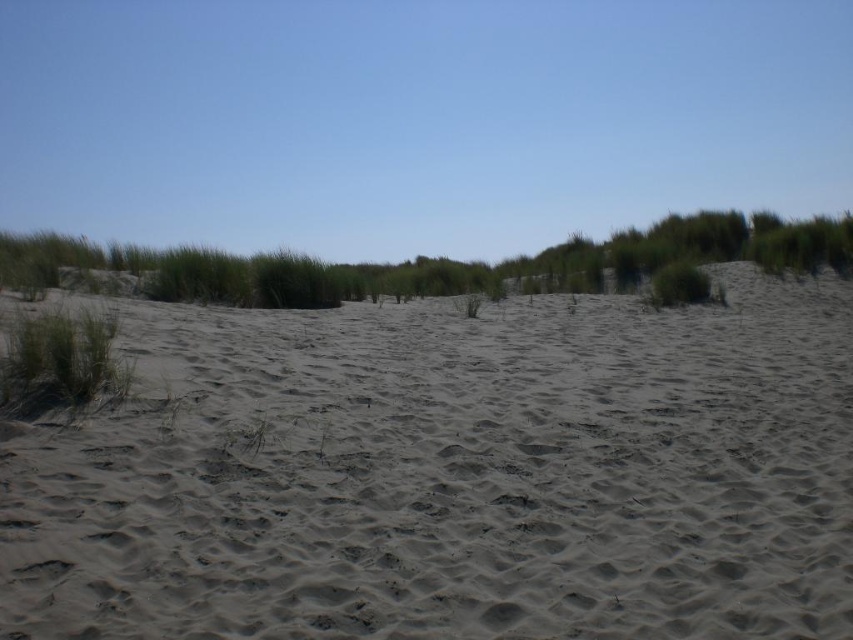
You are a hiker trying to cross the sandy terrain. You notice the smooth sand at center and the green grass at left. Which surface would you choose to walk on if you want to avoid sinking deeper into the ground?

The smooth sand at center has a greater height compared to the green grass at left, so walking on the green grass at left would result in less sinking since it is lower and firmer.

You are standing at the point closer to the front of the image and want to walk towards the horizon. Which point, point (189, 355) or point (59, 317), is in your path?

Point (59, 317) is closer to you, so it is in your path first before reaching point (189, 355).